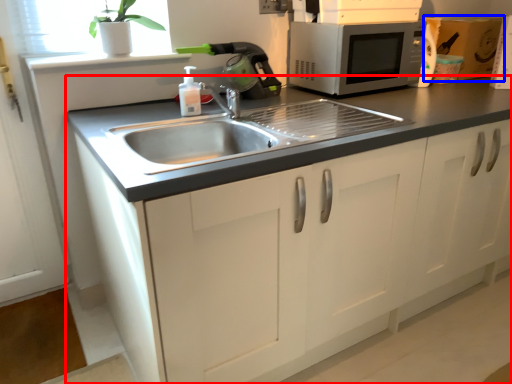
Question: Which object appears closest to the camera in this image, cabinetry (highlighted by a red box) or cardboard box (highlighted by a blue box)?

Choices:
 (A) cabinetry
 (B) cardboard box

Answer: (A)